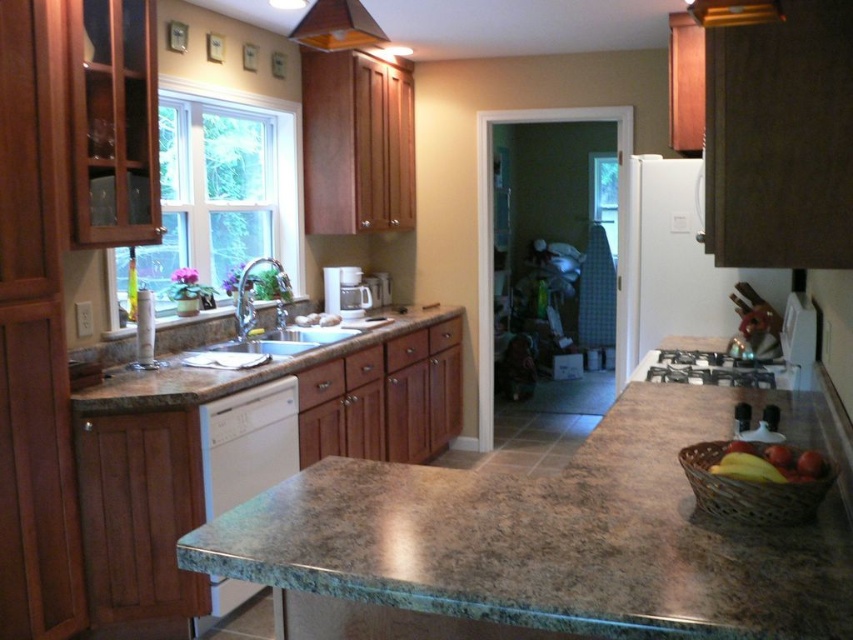
Question: Is orange matte exhaust hood at upper center positioned in front of white matte coffee maker at center?

Choices:
 (A) no
 (B) yes

Answer: (B)

Question: Considering the real-world distances, which object is closest to the green granite countertop at center?

Choices:
 (A) yellow matte banana at right
 (B) white glossy dishwasher at lower left
 (C) orange matte exhaust hood at upper center

Answer: (A)

Question: Is white glossy dishwasher at lower left smaller than satin nickel sink at left?

Choices:
 (A) yes
 (B) no

Answer: (A)

Question: Is brown woven basket at lower right positioned at the back of white matte coffee maker at center?

Choices:
 (A) yes
 (B) no

Answer: (B)

Question: Among these points, which one is nearest to the camera?

Choices:
 (A) (x=242, y=321)
 (B) (x=358, y=26)

Answer: (B)

Question: Which object appears closest to the camera in this image?

Choices:
 (A) satin nickel sink at left
 (B) white glossy dishwasher at lower left
 (C) brown woven basket at lower right
 (D) yellow matte banana at right

Answer: (C)